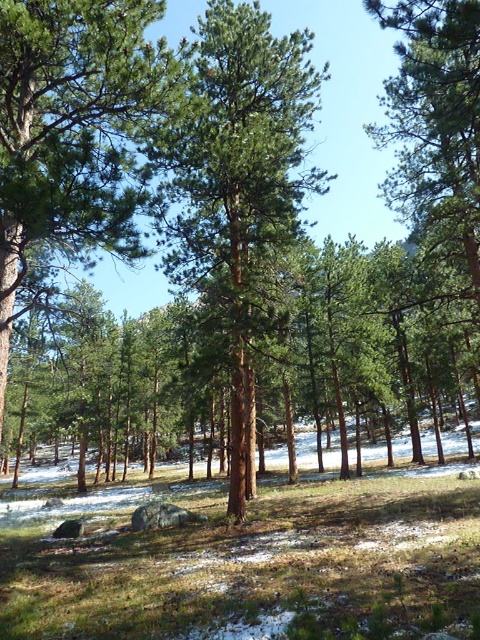
You are a hiker trying to navigate through the forest. You notice two trees at the center of your view, a green rough bark tree at center and a green matte tree at center. Which tree has a narrower trunk?

The green rough bark tree at center has a narrower trunk than the green matte tree at center.

You are a hiker standing in the forest scene described. You spot two points marked in the image. The first point is at coordinates point (128, 6) and the second is at point (297, 118). Which point is nearer to you as you stand in the scene?

Point (128, 6) is closer to the viewer than point (297, 118).

You are standing in the forest and want to take a photo of the green rough bark tree at center. If your camera has a maximum focus range of 6 meters, will you need to move closer to capture it clearly?

The green rough bark tree at center is 6.58 meters away from the camera, which exceeds the maximum focus range of 6 meters. Therefore, you need to move closer to ensure the tree is in focus.